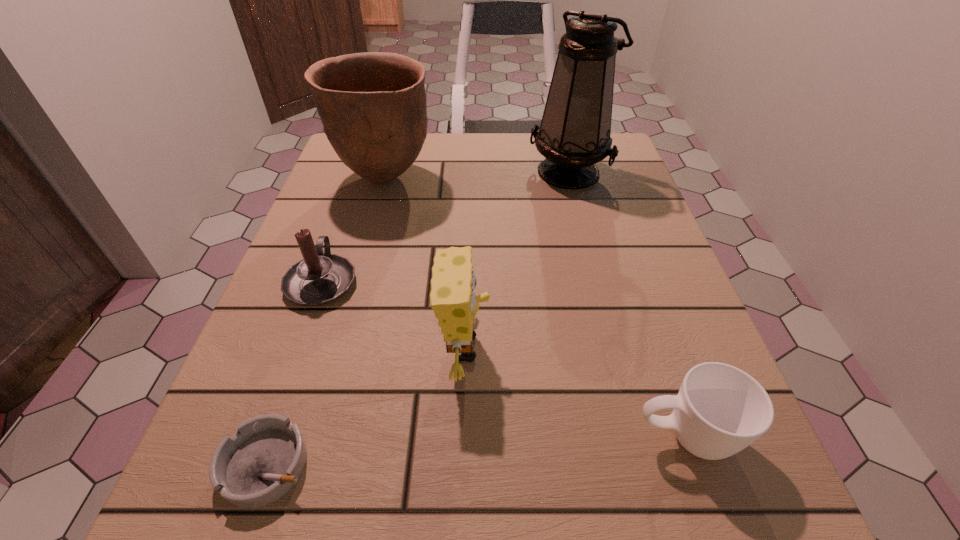
Where is `pottery that is at the left edge`? Image resolution: width=960 pixels, height=540 pixels. pottery that is at the left edge is located at coordinates (372, 105).

Identify the location of candle located in the left edge section of the desktop. (320, 277).

You are a GUI agent. You are given a task and a screenshot of the screen. Output one action in this format:
    pyautogui.click(x=<x>, y=<y>)
    Task: Click on the ashtray present at the left edge
    Image resolution: width=960 pixels, height=540 pixels.
    Given the screenshot: What is the action you would take?
    pyautogui.click(x=263, y=460)

I want to click on oil lamp present at the right edge, so click(574, 135).

The image size is (960, 540). I want to click on cup that is positioned at the right edge, so click(x=719, y=410).

Locate an element on the screen. This screenshot has height=540, width=960. object that is at the far left corner is located at coordinates 372,105.

This screenshot has width=960, height=540. I want to click on object at the near left corner, so click(x=263, y=460).

You are a GUI agent. You are given a task and a screenshot of the screen. Output one action in this format:
    pyautogui.click(x=<x>, y=<y>)
    Task: Click on the object located in the far right corner section of the desktop
    The height and width of the screenshot is (540, 960).
    Given the screenshot: What is the action you would take?
    pyautogui.click(x=574, y=135)

Identify the location of vacant area at the far edge of the desktop. (423, 164).

In the image, there is a desktop. At what (x,y) coordinates should I click in order to perform the action: click on vacant space at the left edge. Please return your answer as a coordinate pair (x, y). This screenshot has width=960, height=540. Looking at the image, I should click on (307, 366).